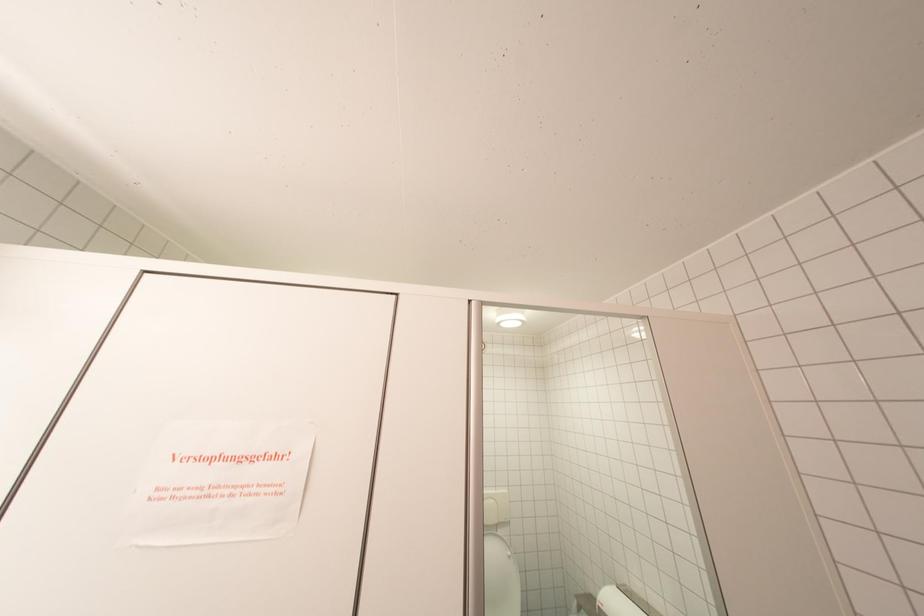
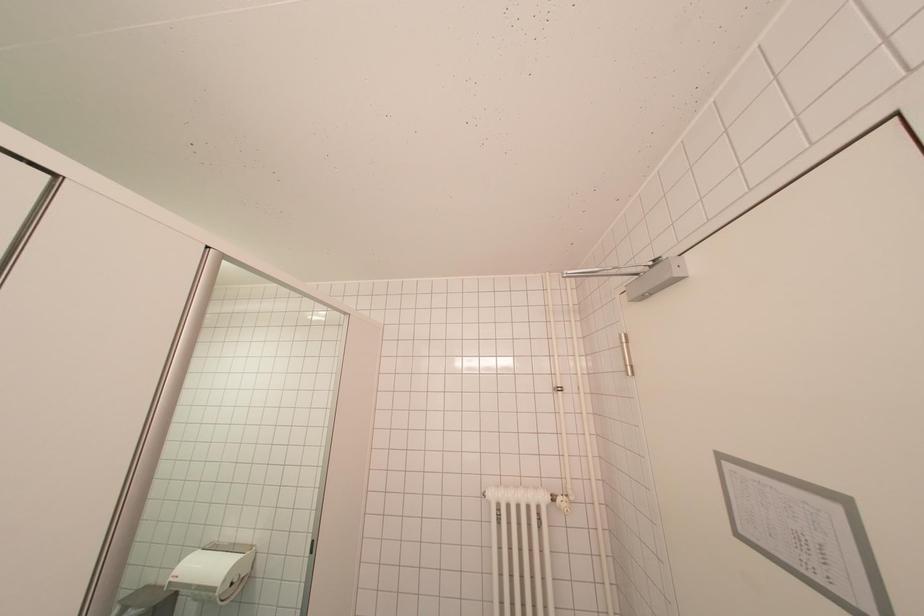
Question: Based on the continuous images, in which direction is the camera rotating? Reply with the corresponding letter.

Choices:
 (A) Left
 (B) Right
 (C) Up
 (D) Down

Answer: (B)